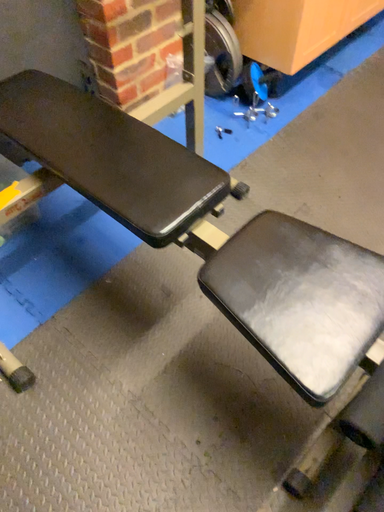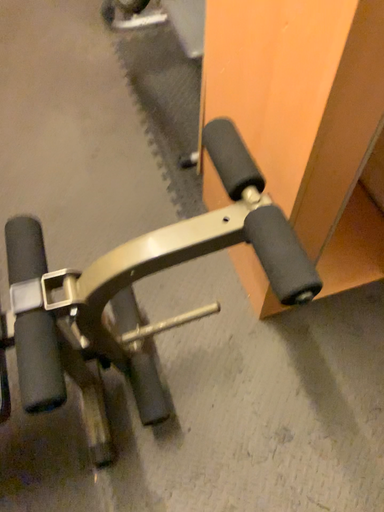
Question: How did the camera likely rotate when shooting the video?

Choices:
 (A) rotated downward
 (B) rotated upward

Answer: (B)